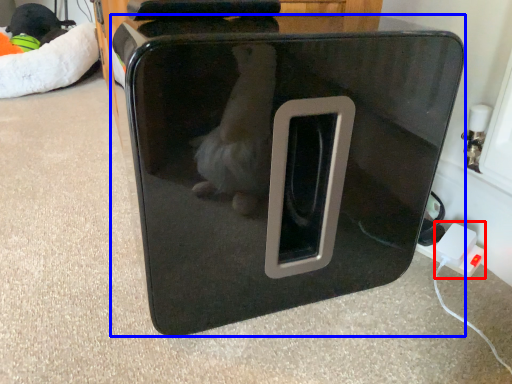
Question: Which point is further to the camera, electric outlet (highlighted by a red box) or home appliance (highlighted by a blue box)?

Choices:
 (A) electric outlet
 (B) home appliance

Answer: (A)